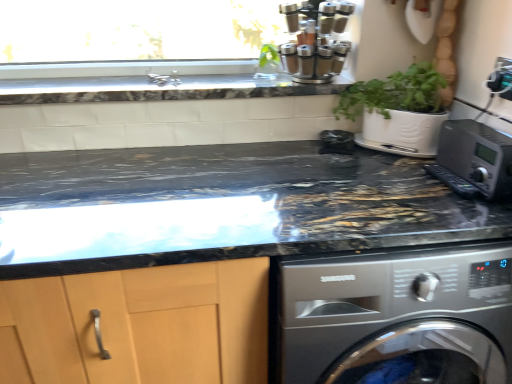
Where is `vacant region to the left of satin silver spice rack at upper center`? Image resolution: width=512 pixels, height=384 pixels. vacant region to the left of satin silver spice rack at upper center is located at coordinates (243, 81).